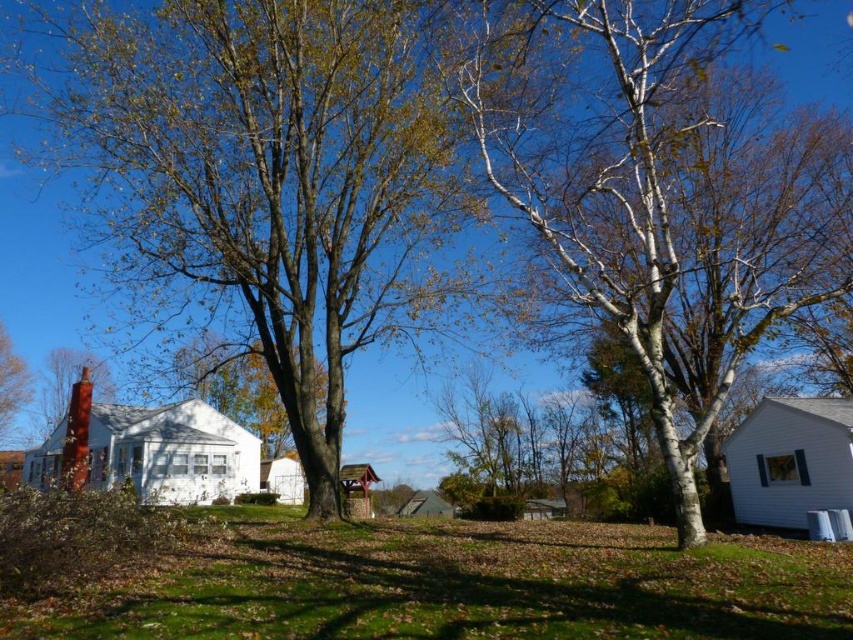
You are a gardener planning to plant a new tree in the suburban area shown. The white smooth birch tree at center and the green grass at center are already present. Considering their sizes, which one would require more space in the garden?

The white smooth birch tree at center has a larger size compared to green grass at center, so it would require more space in the garden.

You are a bird looking for a nesting spot. You see the white smooth birch tree at center and the white bark birch tree at right. Which tree should you choose if you prefer nesting in a taller tree?

The white smooth birch tree at center is much taller than the white bark birch tree at right, so you should choose the white smooth birch tree at center for nesting.

You are standing in the middle of the suburban scene and want to walk towards the green grass at center. Which direction should you move relative to the white smooth birch tree at center?

To reach the green grass at center, you should move behind the white smooth birch tree at center since the green grass at center is located behind it.